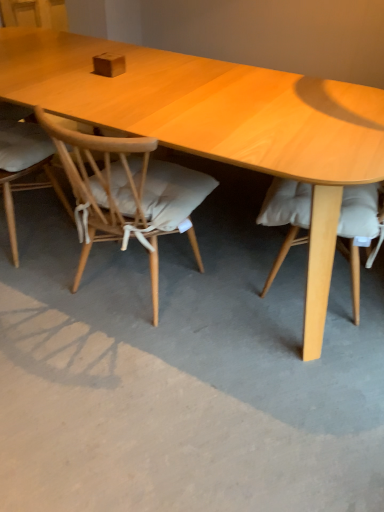
Identify the location of vacant point to the left of light wood chair at center, the second chair viewed from the left. This screenshot has height=512, width=384. (44, 285).